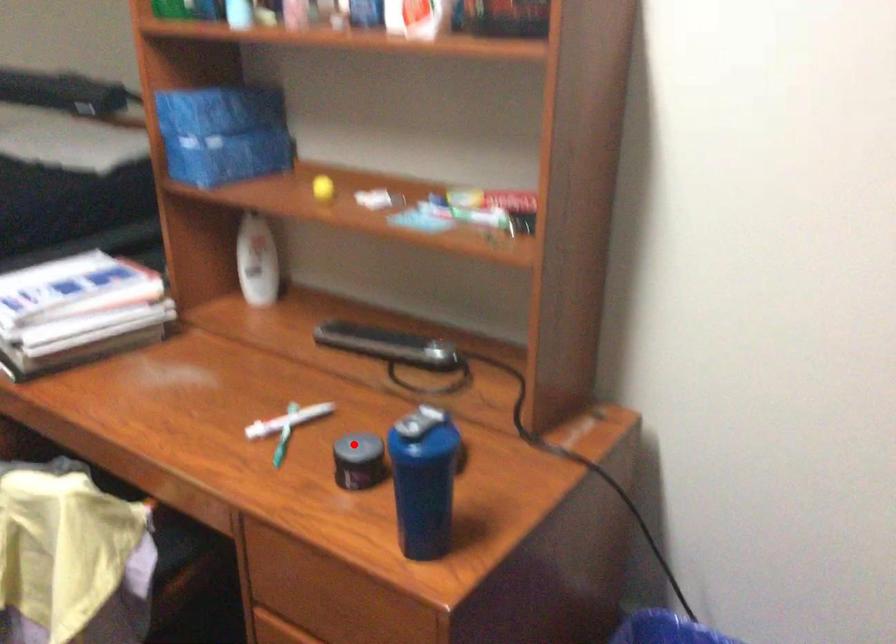
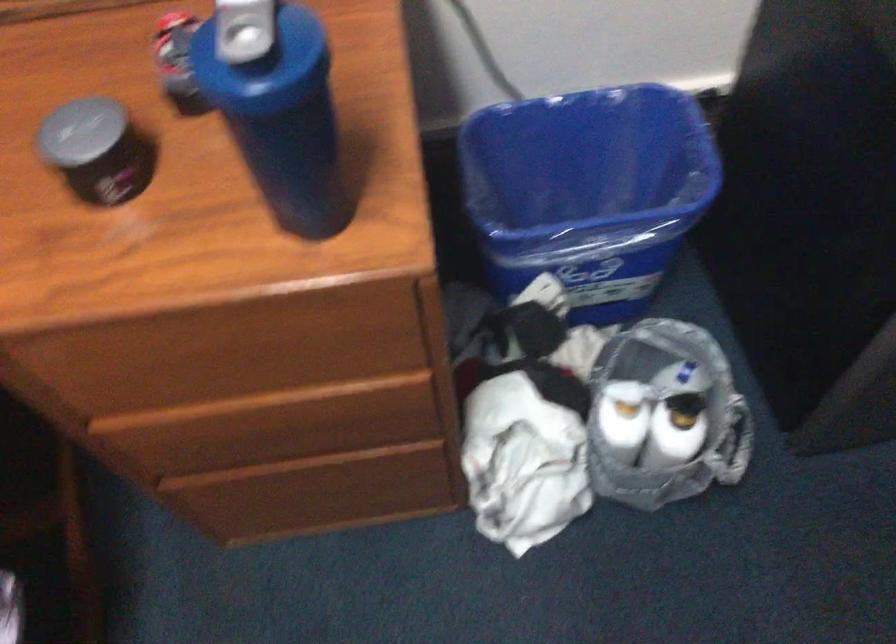
In the second image, find the point that corresponds to the highlighted location in the first image.

(80, 131)